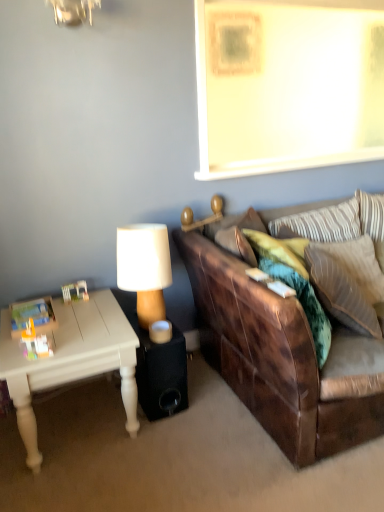
You are a GUI agent. You are given a task and a screenshot of the screen. Output one action in this format:
    pyautogui.click(x=<x>, y=<y>)
    Task: Click on the vacant region in front of black fabric speaker at lower center
    Image resolution: width=384 pixels, height=512 pixels.
    Given the screenshot: What is the action you would take?
    pyautogui.click(x=153, y=437)